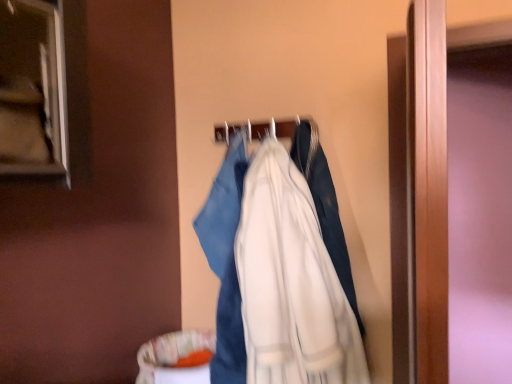
What do you see at coordinates (265, 129) in the screenshot?
I see `white fabric hanger at center` at bounding box center [265, 129].

The height and width of the screenshot is (384, 512). In order to click on white fabric hanger at center in this screenshot , I will do `click(265, 129)`.

In order to face white fabric hanger at center, should I rotate leftwards or rightwards?

Turn right by 0.553 degrees to look at white fabric hanger at center.

You are a GUI agent. You are given a task and a screenshot of the screen. Output one action in this format:
    pyautogui.click(x=<x>, y=<y>)
    Task: Click on the white cotton coat at center
    The width and height of the screenshot is (512, 384).
    Given the screenshot: What is the action you would take?
    pyautogui.click(x=276, y=275)

This screenshot has height=384, width=512. What do you see at coordinates (276, 275) in the screenshot?
I see `white cotton coat at center` at bounding box center [276, 275].

The width and height of the screenshot is (512, 384). What are the coordinates of `white fabric hanger at center` in the screenshot? It's located at (265, 129).

Considering the relative positions of white fabric hanger at center and white cotton coat at center in the image provided, is white fabric hanger at center to the right of white cotton coat at center from the viewer's perspective?

In fact, white fabric hanger at center is to the left of white cotton coat at center.

Considering the relative positions of white fabric hanger at center and white cotton coat at center in the image provided, is white fabric hanger at center behind white cotton coat at center?

That is True.

Considering the positions of points (217, 134) and (276, 343), is point (217, 134) closer to camera compared to point (276, 343)?

No, it is behind (276, 343).

From the image's perspective, does white fabric hanger at center appear lower than white cotton coat at center?

No, from the image's perspective, white fabric hanger at center is not beneath white cotton coat at center.

From the picture: From a real-world perspective, between white fabric hanger at center and white cotton coat at center, who is vertically lower?

In real-world perspective, white cotton coat at center is lower.

Is white fabric hanger at center wider or thinner than white cotton coat at center?

In the image, white fabric hanger at center appears to be more narrow than white cotton coat at center.

Does white fabric hanger at center have a lesser height compared to white cotton coat at center?

Indeed, white fabric hanger at center has a lesser height compared to white cotton coat at center.

Which of these two, white fabric hanger at center or white cotton coat at center, is smaller?

Smaller between the two is white fabric hanger at center.

Is white fabric hanger at center spatially inside white cotton coat at center, or outside of it?

white fabric hanger at center is not inside white cotton coat at center, it's outside.

Is the surface of white fabric hanger at center in direct contact with white cotton coat at center?

No, white fabric hanger at center is not beside white cotton coat at center.

Is white fabric hanger at center oriented away from white cotton coat at center?

No.

In the scene shown: What's the angular difference between white fabric hanger at center and white cotton coat at center's facing directions?

0.000631 degrees.

You are a GUI agent. You are given a task and a screenshot of the screen. Output one action in this format:
    pyautogui.click(x=<x>, y=<y>)
    Task: Click on the hanger that is above the white cotton coat at center (from the image's perspective)
    The height and width of the screenshot is (384, 512).
    Given the screenshot: What is the action you would take?
    pyautogui.click(x=265, y=129)

Can you confirm if white cotton coat at center is positioned to the left of white fabric hanger at center?

No.

Which object is closer to the camera taking this photo, white cotton coat at center or white fabric hanger at center?

white cotton coat at center.

Is point (230, 253) closer or farther from the camera than point (228, 129)?

Point (230, 253).

From the image's perspective, which object appears higher, white cotton coat at center or white fabric hanger at center?

white fabric hanger at center appears higher in the image.

From a real-world perspective, who is located higher, white cotton coat at center or white fabric hanger at center?

In real-world perspective, white fabric hanger at center is above.

Between white cotton coat at center and white fabric hanger at center, which one has larger width?

Wider between the two is white cotton coat at center.

Between white cotton coat at center and white fabric hanger at center, which one has more height?

With more height is white cotton coat at center.

Which of these two, white cotton coat at center or white fabric hanger at center, is smaller?

Smaller between the two is white fabric hanger at center.

Is white fabric hanger at center completely or partially inside white cotton coat at center?

Definitely not — white fabric hanger at center is not inside white cotton coat at center.

Is white cotton coat at center not near white fabric hanger at center?

No, white cotton coat at center is not far from white fabric hanger at center.

Could you tell me if white cotton coat at center is facing white fabric hanger at center?

No, white cotton coat at center is not oriented towards white fabric hanger at center.

How many degrees apart are the facing directions of white cotton coat at center and white fabric hanger at center?

The facing directions of white cotton coat at center and white fabric hanger at center are 0.000631 degrees apart.

Identify the location of fancy dress on the right of white fabric hanger at center. (276, 275).

Where is `hanger above the white cotton coat at center (from a real-world perspective)`? The width and height of the screenshot is (512, 384). hanger above the white cotton coat at center (from a real-world perspective) is located at coordinates (265, 129).

The image size is (512, 384). In the image, there is a white fabric hanger at center. In order to click on fancy dress below it (from the image's perspective) in this screenshot , I will do `click(276, 275)`.